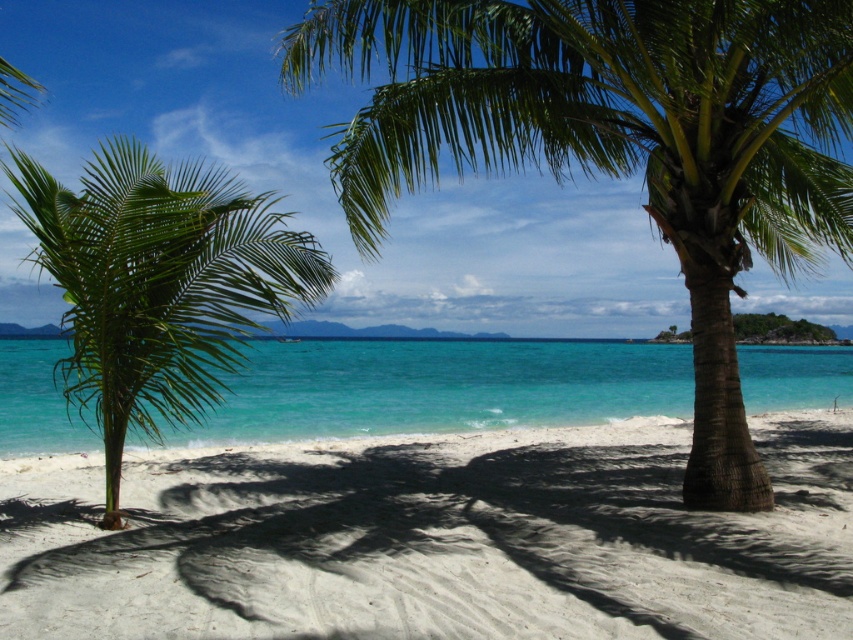
You are a photographer standing on the beach. You want to take a photo that includes both the green leafy palm tree at left and the turquoise glossy water at center. Which object will appear larger in the photo?

The green leafy palm tree at left will appear larger in the photo because it is closer to the photographer than the turquoise glossy water at center.

You are a beachgoer planning to set up an umbrella on the white sandy beach at center. Considering the location of the green leafy palm tree at center, will the beach area under the tree be sunny or shaded during midday?

The white sandy beach at center is positioned under the green leafy palm tree at center, so the area under the tree will be shaded during midday.